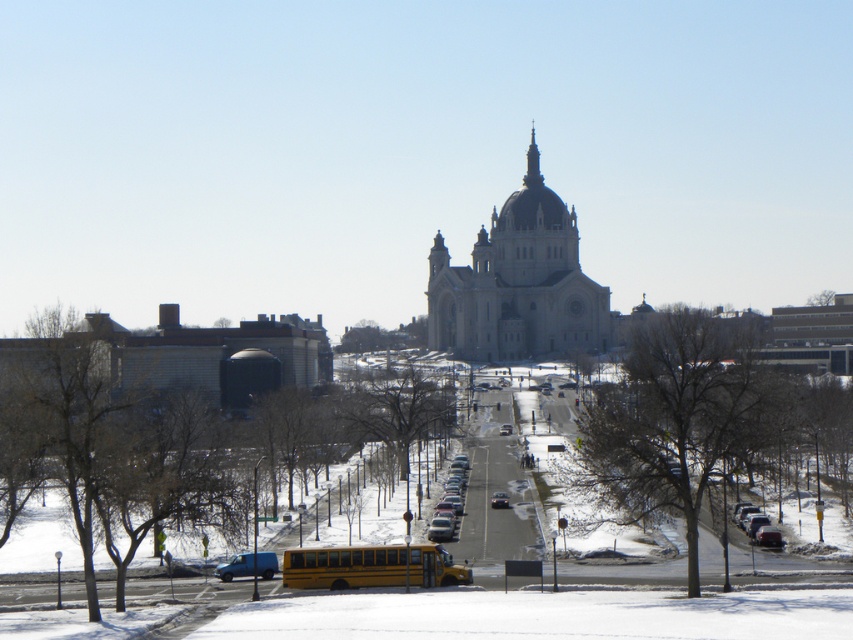
Question: In this image, where is white stone church at center located relative to blue matte van at lower left?

Choices:
 (A) below
 (B) above

Answer: (B)

Question: Which point is farther to the camera?

Choices:
 (A) yellow matte/solid school bus at center
 (B) white stone church at center

Answer: (B)

Question: Does yellow matte/solid school bus at center come behind blue matte van at lower left?

Choices:
 (A) no
 (B) yes

Answer: (A)

Question: Estimate the real-world distances between objects in this image. Which object is farther from the matte black car at center?

Choices:
 (A) yellow matte/solid school bus at center
 (B) blue matte van at lower left

Answer: (A)

Question: Considering the real-world distances, which object is farthest from the blue matte van at lower left?

Choices:
 (A) yellow matte/solid school bus at center
 (B) matte black car at center
 (C) white stone church at center

Answer: (C)

Question: Is yellow matte/solid school bus at center further to the viewer compared to blue matte van at lower left?

Choices:
 (A) yes
 (B) no

Answer: (B)